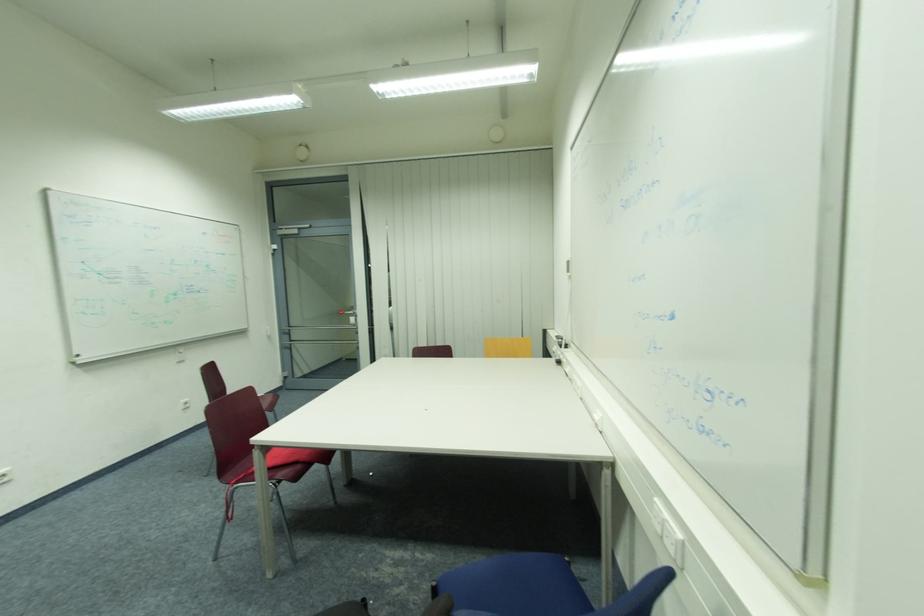
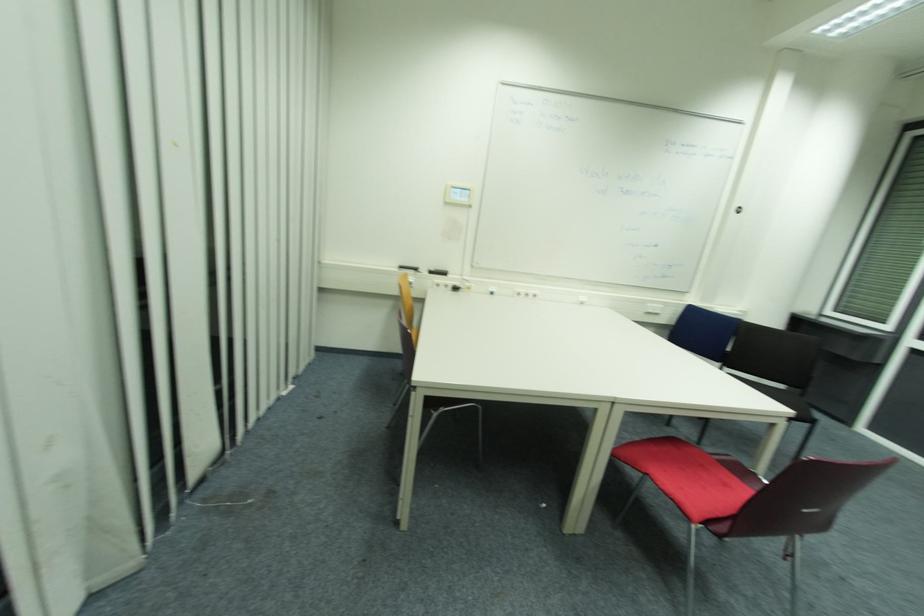
In the second image, find the point that corresponds to the point at 670,516 in the first image.

(658, 306)